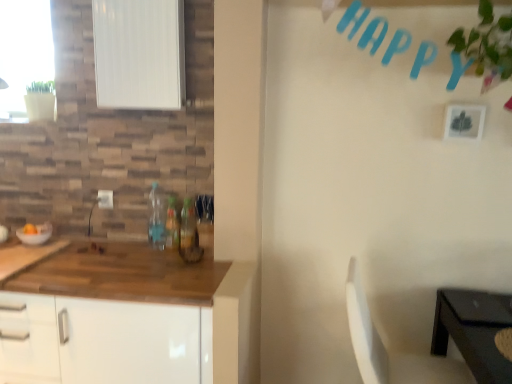
Find the location of a particular element. vacant space that is in between white glossy bowl at left and translucent plastic bottle at center, which is the second bottle in left-to-right order is located at coordinates (94, 244).